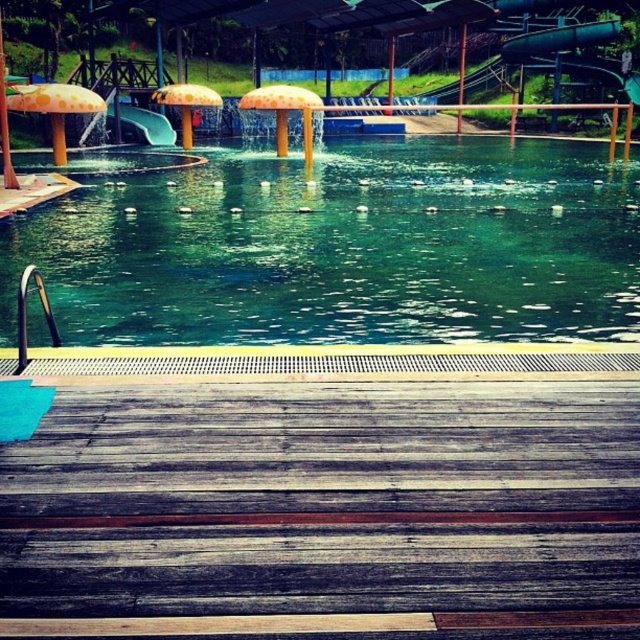
Question: Which point is closer to the camera taking this photo?

Choices:
 (A) (140, 125)
 (B) (253, 109)

Answer: (B)

Question: Which point appears closest to the camera in this image?

Choices:
 (A) (301, 102)
 (B) (51, 90)
 (C) (131, 106)

Answer: (B)

Question: Among these objects, which one is farthest from the camera?

Choices:
 (A) yellow matte umbrella at center
 (B) yellow matte umbrella at upper left
 (C) orange matte umbrella at center
 (D) green rubber slide at upper left

Answer: (D)

Question: Can you confirm if green glossy water at center is bigger than orange matte umbrella at center?

Choices:
 (A) no
 (B) yes

Answer: (A)

Question: Can you confirm if green glossy water at center is smaller than yellow matte umbrella at upper left?

Choices:
 (A) no
 (B) yes

Answer: (A)

Question: Does yellow matte umbrella at upper left appear on the left side of orange matte umbrella at center?

Choices:
 (A) yes
 (B) no

Answer: (A)